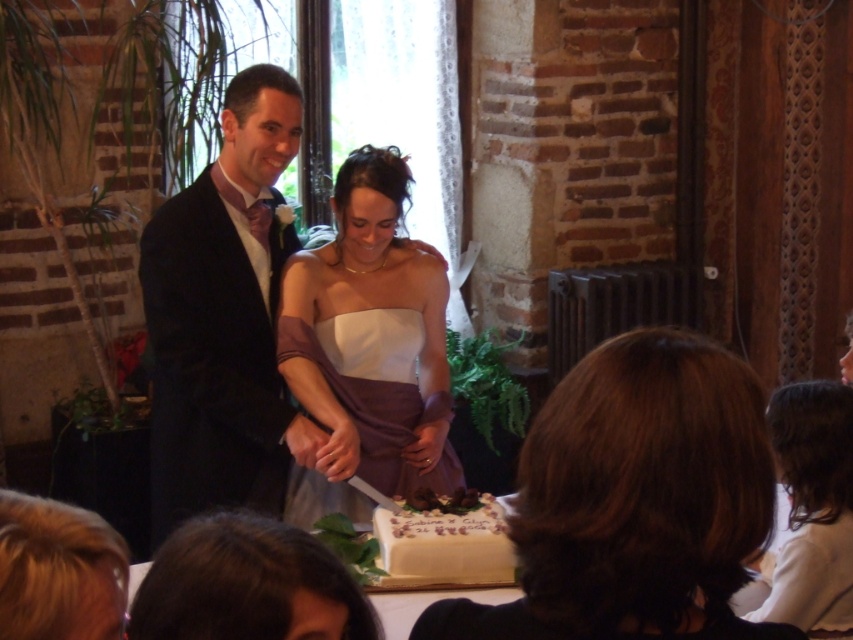
Is point (248, 76) more distant than point (461, 579)?

Yes.

Image resolution: width=853 pixels, height=640 pixels. What do you see at coordinates (224, 317) in the screenshot?
I see `matte black suit at center` at bounding box center [224, 317].

In order to click on matte black suit at center in this screenshot , I will do `click(224, 317)`.

Is brown hair at center thinner than white textured cake at center?

No.

Which is more to the right, brown hair at center or white textured cake at center?

brown hair at center is more to the right.

Locate an element on the screen. The width and height of the screenshot is (853, 640). brown hair at center is located at coordinates (635, 500).

Does brown hair at center have a larger size compared to white satin dress at lower right?

No, brown hair at center is not bigger than white satin dress at lower right.

Is brown hair at center shorter than white satin dress at lower right?

Yes, brown hair at center is shorter than white satin dress at lower right.

Is point (708, 564) positioned in front of point (811, 545)?

Yes.

Locate an element on the screen. The height and width of the screenshot is (640, 853). brown hair at center is located at coordinates (635, 500).